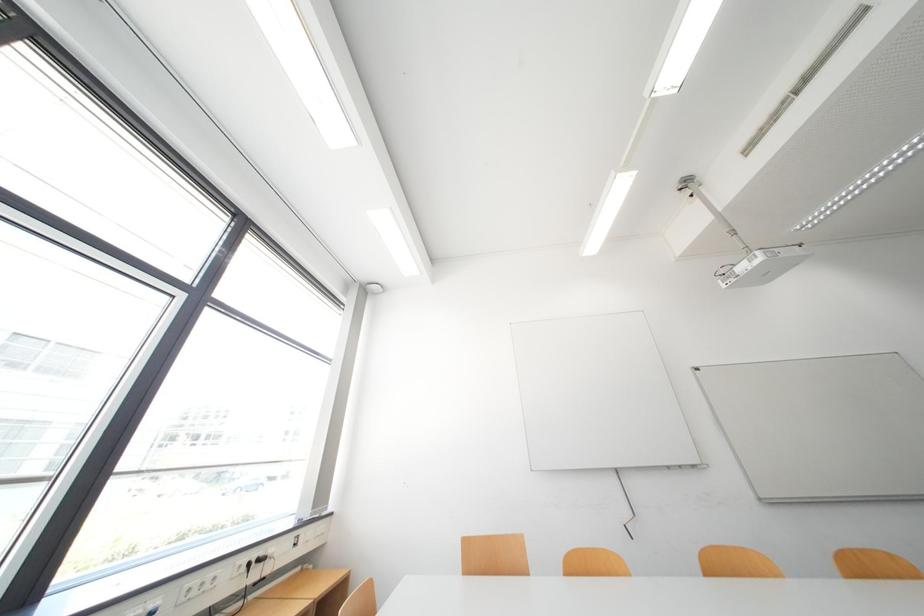
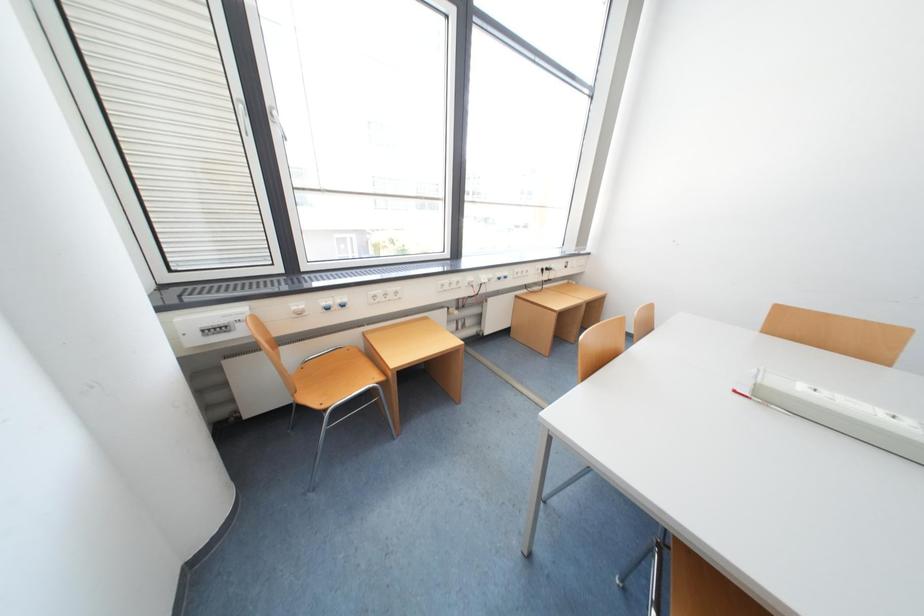
How did the camera likely rotate?

The camera's rotation is toward left-down.